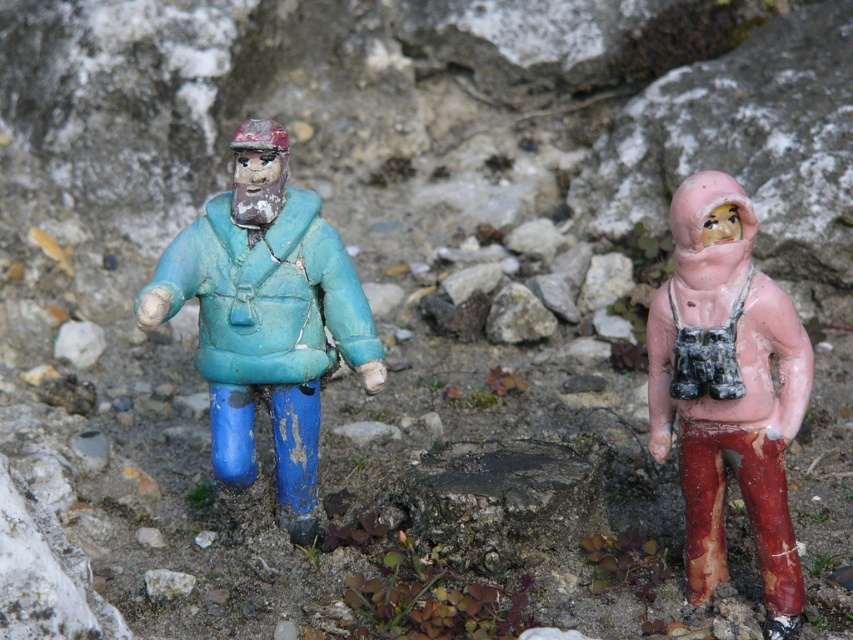
In the scene shown: You are setting up a display for an outdoor exhibition and have two figurines to place on a narrow shelf. The shelf can only accommodate items where the total width does not exceed 40 cm. You know the matte blue plastic figure at left is wider than the pink matte figure at right. If the combined width of both figures is exactly 40 cm, which figure should you place first to ensure both fit on the shelf?

Since the matte blue plastic figure at left is wider than the pink matte figure at right, you should place the matte blue plastic figure at left first to ensure both fit on the shelf. This way, there will be enough space for the wider figure first, and the remaining space will accommodate the narrower pink matte figure at right.

You are a hiker who wants to place a new rock between the matte blue plastic figure at left and the pink matte figure at right. Where should you place the rock so that it is between them?

The rock should be placed between the matte blue plastic figure at left and the pink matte figure at right, directly below the matte blue plastic figure at left since it is located above the pink matte figure at right.

You are standing in a park and see two figurines. One is a blue plastic figure at left and the other is a pinkish figure at right. You want to place a new decorative rock at point (265,316). Will the rock be placed on the blue plastic figure at left or the pinkish figure at right?

The point (265,316) is on the matte blue plastic figure at left, so placing the decorative rock there would put it on the blue plastic figure at left.